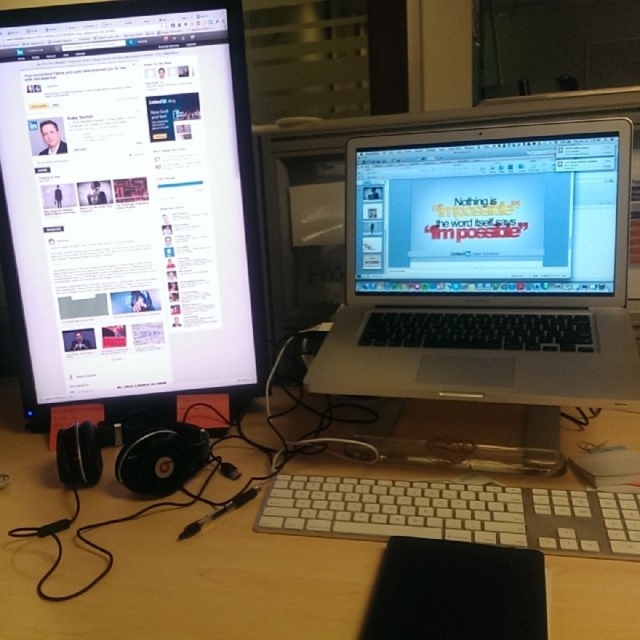
Question: Does wooden desk at center appear under white plastic keyboard at center?

Choices:
 (A) yes
 (B) no

Answer: (A)

Question: Which point is closer to the camera?

Choices:
 (A) white plastic keyboard at center
 (B) matte black monitor at left
 (C) silver metallic laptop at center

Answer: (A)

Question: Among these objects, which one is farthest from the camera?

Choices:
 (A) matte black monitor at left
 (B) wooden desk at center
 (C) silver metallic laptop at center
 (D) white plastic keyboard at center

Answer: (A)

Question: Does silver metallic laptop at center have a smaller size compared to wooden desk at center?

Choices:
 (A) no
 (B) yes

Answer: (B)

Question: Which of these objects is positioned farthest from the wooden desk at center?

Choices:
 (A) white plastic keyboard at center
 (B) silver metallic laptop at center
 (C) matte black monitor at left

Answer: (C)

Question: Where is matte black monitor at left located in relation to white plastic keyboard at center in the image?

Choices:
 (A) below
 (B) above

Answer: (B)